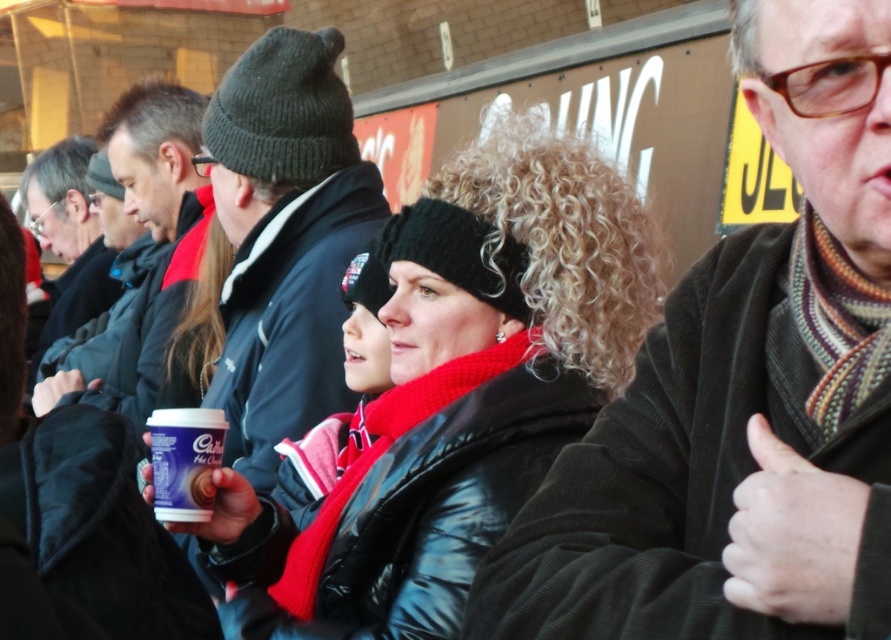
Looking at the knitted wool beanie at upper center and the purple matte cup at center, which object is positioned to the right of the other?

The knitted wool beanie at upper center is to the right of the purple matte cup at center.

You are a fashion designer analyzing the image. You need to determine which item takes up more visual space in the image between the black matte jacket at center and the knitted wool beanie at upper center. Which one should you focus on for your design critique?

The knitted wool beanie at upper center occupies more space than the black matte jacket at center, so you should focus on the knitted wool beanie at upper center for your design critique.

You are a fashion designer observing the central figure in the image. You need to determine which item of clothing is shorter in height between the knitted scarf at center and the matte black jacket at center. Which one is it?

The knitted scarf at center is not as tall as matte black jacket at center, so the knitted scarf at center is shorter in height.